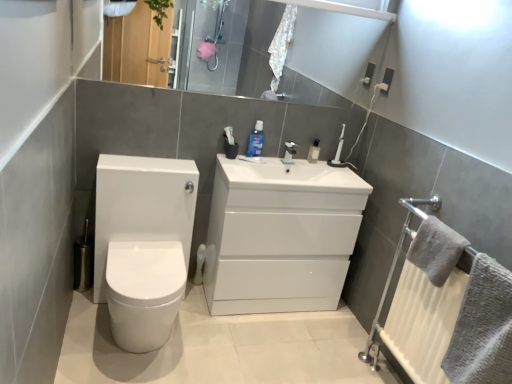
Locate an element on the screen. vacant area that lies between matte silver faucet at upper center and blue glossy mouthwash at center, which is counted as the second mouthwash, starting from the right is located at coordinates (272, 153).